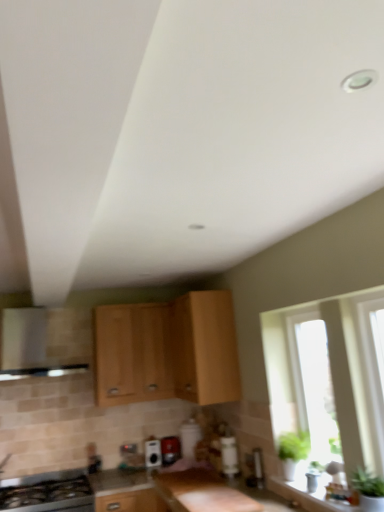
You are a GUI agent. You are given a task and a screenshot of the screen. Output one action in this format:
    pyautogui.click(x=<x>, y=<y>)
    Task: Click on the blank space above smooth granite countertop at center (from a real-world perspective)
    This screenshot has width=384, height=512.
    Given the screenshot: What is the action you would take?
    pyautogui.click(x=119, y=485)